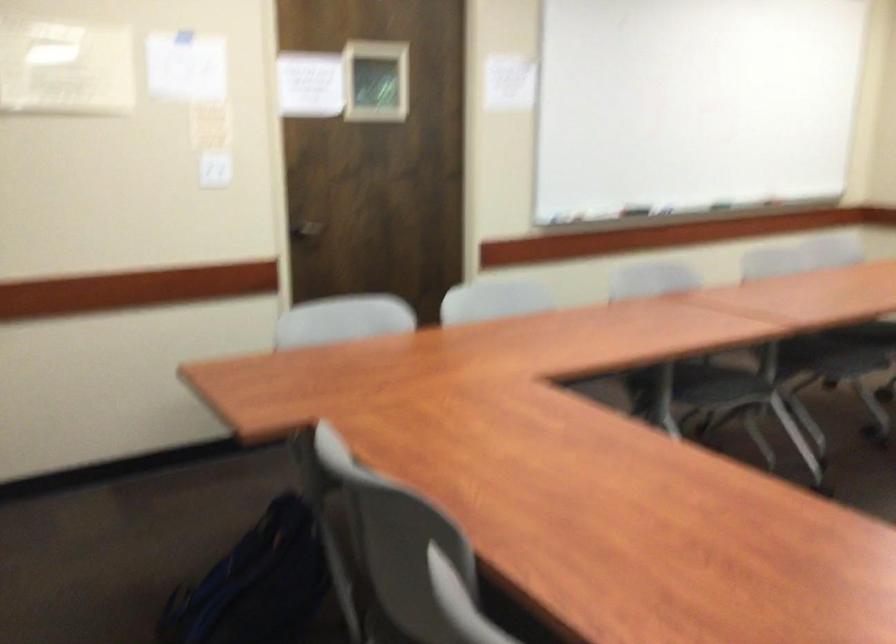
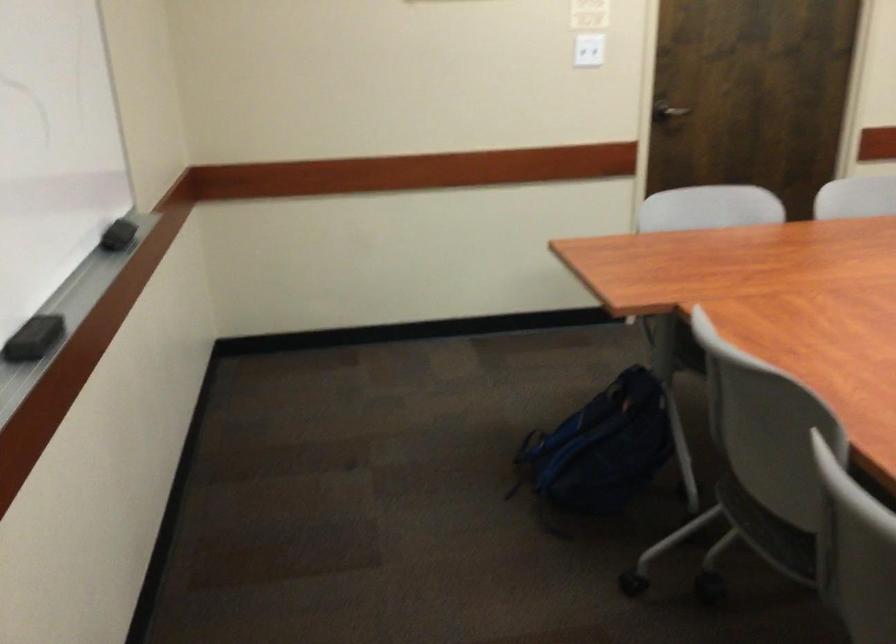
In the second image, find the point that corresponds to point (295, 232) in the first image.

(667, 111)